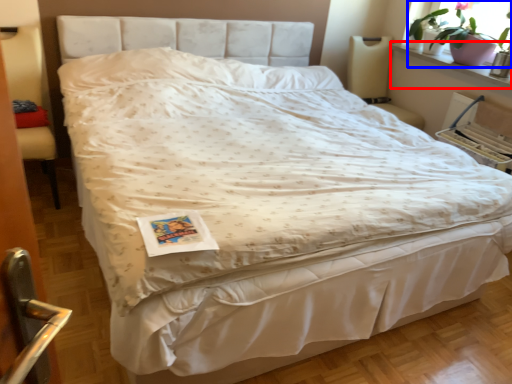
Question: Which of the following is the closest to the observer, window sill (highlighted by a red box) or houseplant (highlighted by a blue box)?

Choices:
 (A) window sill
 (B) houseplant

Answer: (A)